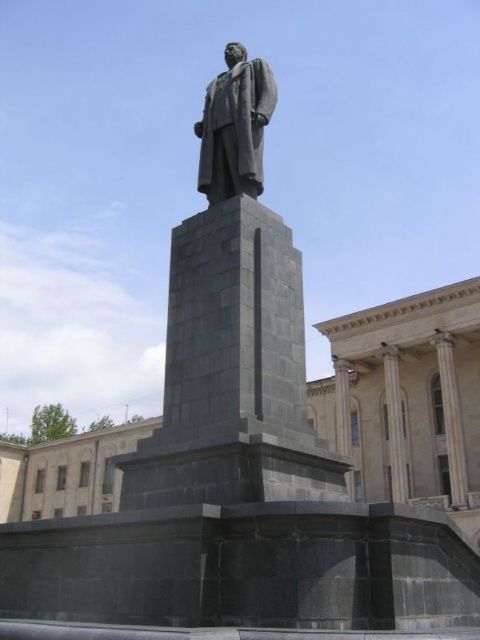
Consider the image. Can you confirm if bronze statue at center is positioned below white marble pillar at center?

No.

Can you confirm if bronze statue at center is taller than white marble pillar at center?

No.

I want to click on bronze statue at center, so click(x=235, y=125).

Identify the location of bronze statue at center. The width and height of the screenshot is (480, 640). (235, 125).

Is matte gray statue at center thinner than bronze statue at center?

No, matte gray statue at center is not thinner than bronze statue at center.

Is point (214, 492) positioned after point (204, 168)?

No, it is not.

Does point (208, 413) come behind point (252, 128)?

No, (208, 413) is in front of (252, 128).

Find the location of `matte gray statue at center`. matte gray statue at center is located at coordinates (232, 330).

Which is in front, point (196, 419) or point (393, 481)?

Point (196, 419) is more forward.

Which of these two, matte gray statue at center or white marble pillar at center, stands shorter?

Standing shorter between the two is matte gray statue at center.

Looking at this image, measure the distance between point (162,486) and camera.

The distance of point (162,486) from camera is 58.44 feet.

Image resolution: width=480 pixels, height=640 pixels. In order to click on matte gray statue at center in this screenshot , I will do `click(232, 330)`.